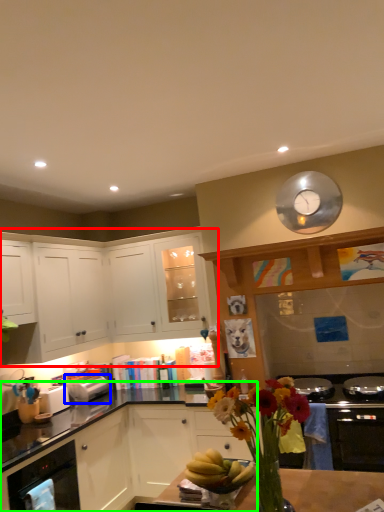
Question: Based on their relative distances, which object is farther from cabinetry (highlighted by a red box)? Choose from toaster (highlighted by a blue box) and cabinetry (highlighted by a green box).

Choices:
 (A) toaster
 (B) cabinetry

Answer: (A)